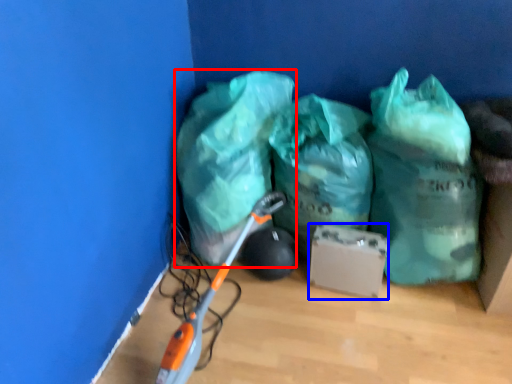
Question: Among these objects, which one is farthest to the camera, plastic bag (highlighted by a red box) or cardboard box (highlighted by a blue box)?

Choices:
 (A) plastic bag
 (B) cardboard box

Answer: (B)